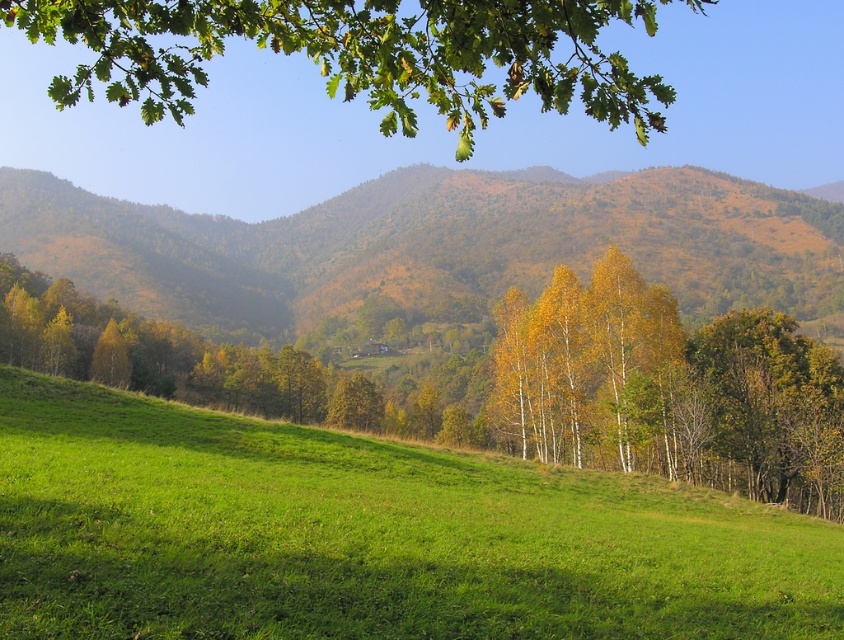
From the picture: You are a landscape photographer planning to capture the entire scene in one shot. Given that the green grassy hillside at lower center and the green leafy branch at upper center are both in your frame, which object would you need to adjust your camera angle to avoid cropping?

The green leafy branch at upper center occupies more space in the frame than the green grassy hillside at lower center, so you should adjust your camera angle to ensure the larger green leafy branch at upper center is fully visible without being cut off.